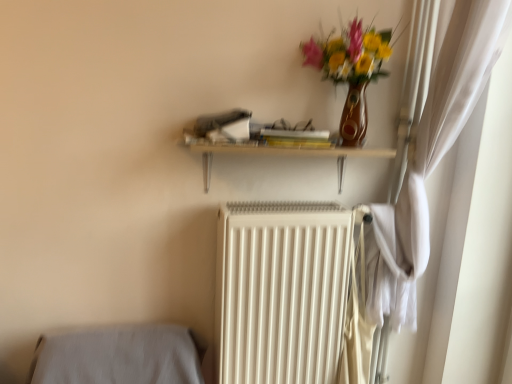
Question: Is wooden shelf at upper center facing away from white matte radiator at center?

Choices:
 (A) yes
 (B) no

Answer: (B)

Question: Does wooden shelf at upper center have a smaller size compared to white matte radiator at center?

Choices:
 (A) yes
 (B) no

Answer: (A)

Question: From the image's perspective, is wooden shelf at upper center on white matte radiator at center?

Choices:
 (A) no
 (B) yes

Answer: (B)

Question: Can you confirm if wooden shelf at upper center is shorter than white matte radiator at center?

Choices:
 (A) yes
 (B) no

Answer: (A)

Question: Is wooden shelf at upper center outside white matte radiator at center?

Choices:
 (A) no
 (B) yes

Answer: (B)

Question: Is wooden shelf at upper center in front of or behind white matte radiator at center in the image?

Choices:
 (A) front
 (B) behind

Answer: (A)

Question: In terms of width, does wooden shelf at upper center look wider or thinner when compared to white matte radiator at center?

Choices:
 (A) wide
 (B) thin

Answer: (B)

Question: From the image's perspective, is wooden shelf at upper center located above or below white matte radiator at center?

Choices:
 (A) above
 (B) below

Answer: (A)

Question: From their relative heights in the image, would you say wooden shelf at upper center is taller or shorter than white matte radiator at center?

Choices:
 (A) short
 (B) tall

Answer: (A)

Question: From a real-world perspective, is white matte radiator at center physically located above or below matte brown vase with flowers at upper right?

Choices:
 (A) below
 (B) above

Answer: (A)

Question: From the image's perspective, is white matte radiator at center above or below matte brown vase with flowers at upper right?

Choices:
 (A) above
 (B) below

Answer: (B)

Question: Considering the positions of white matte radiator at center and matte brown vase with flowers at upper right in the image, is white matte radiator at center taller or shorter than matte brown vase with flowers at upper right?

Choices:
 (A) tall
 (B) short

Answer: (A)

Question: Is white matte radiator at center bigger or smaller than matte brown vase with flowers at upper right?

Choices:
 (A) big
 (B) small

Answer: (A)

Question: Considering their positions, is white matte radiator at center located in front of or behind wooden shelf at upper center?

Choices:
 (A) behind
 (B) front

Answer: (A)

Question: In terms of size, does white matte radiator at center appear bigger or smaller than wooden shelf at upper center?

Choices:
 (A) small
 (B) big

Answer: (B)